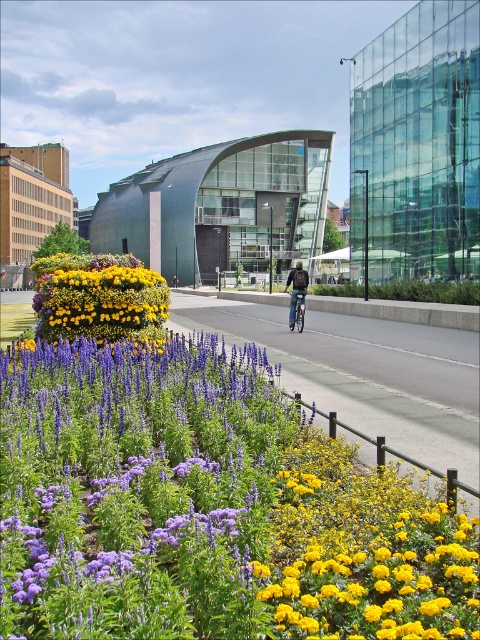
Question: Which object appears closest to the camera in this image?

Choices:
 (A) metallic silver bicycle at center
 (B) matte yellow flowers at center

Answer: (B)

Question: From the image, what is the correct spatial relationship of purple soft-textured flowers at center-left in relation to matte yellow flowers at center?

Choices:
 (A) right
 (B) left

Answer: (A)

Question: Is matte yellow flowers at center wider than metallic silver bicycle at center?

Choices:
 (A) yes
 (B) no

Answer: (A)

Question: Is purple soft-textured flowers at center-left bigger than metallic silver bicycle at center?

Choices:
 (A) yes
 (B) no

Answer: (A)

Question: Among these objects, which one is farthest from the camera?

Choices:
 (A) purple soft-textured flowers at center-left
 (B) dark blue jeans at center
 (C) metallic silver bicycle at center

Answer: (B)

Question: Which of the following is the closest to the observer?

Choices:
 (A) (381, 541)
 (B) (288, 326)
 (C) (295, 300)

Answer: (A)